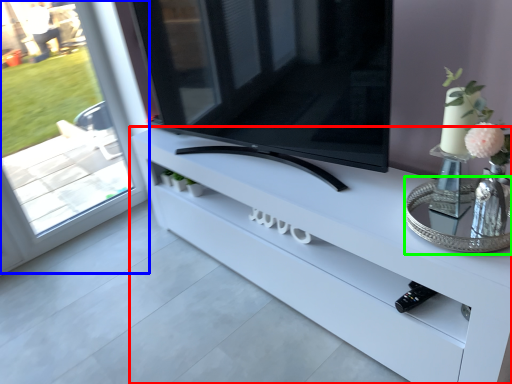
Question: Considering the real-world distances, which object is closest to furniture (highlighted by a red box)? window (highlighted by a blue box) or glass table (highlighted by a green box).

Choices:
 (A) window
 (B) glass table

Answer: (B)